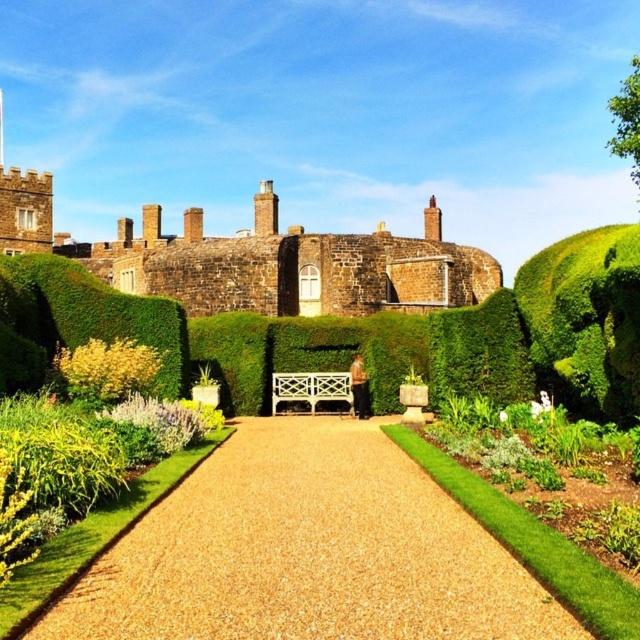
From the picture: You are a gardener planning to water the gravel path at center and the brown stone castle at upper center. Since the castle is made of stone, you need to avoid getting it wet. Which object should you water carefully to prevent overwatering the castle?

The gravel path at center is to the right of brown stone castle at upper center, so you should water the gravel path at center carefully to avoid getting the castle wet.

You are a gardener who needs to place a new decorative statue that is 2 meters tall on the gravel path at center. Considering the height of the brown stone castle at upper center, will the statue be visible from the castle? Please explain your reasoning.

The gravel path at center is not as tall as the brown stone castle at upper center. Since the statue is 2 meters tall and the castle is taller, the statue might be visible from the castle depending on the distance and any obstructions like hedges. However, the castle itself being taller could offer a vantage point for viewing the statue if there is a clear line of sight.

You are a gardener who needs to water the plants along the gravel path at center and the green leafy bush at center. Which object is taller so you know which requires a taller watering can?

The green leafy bush at center is taller than the gravel path at center, so you need a taller watering can for the green leafy bush at center.